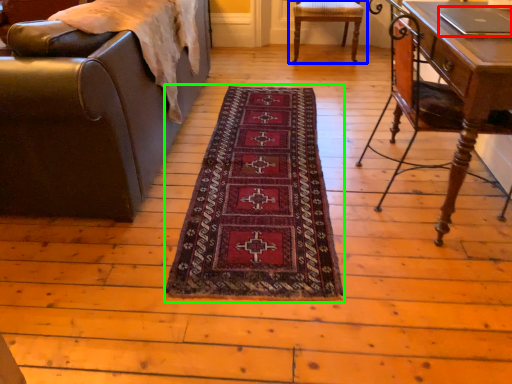
Question: Which object is the closest to the laptop (highlighted by a red box)? Choose among these: chair (highlighted by a blue box) or mat (highlighted by a green box).

Choices:
 (A) chair
 (B) mat

Answer: (B)